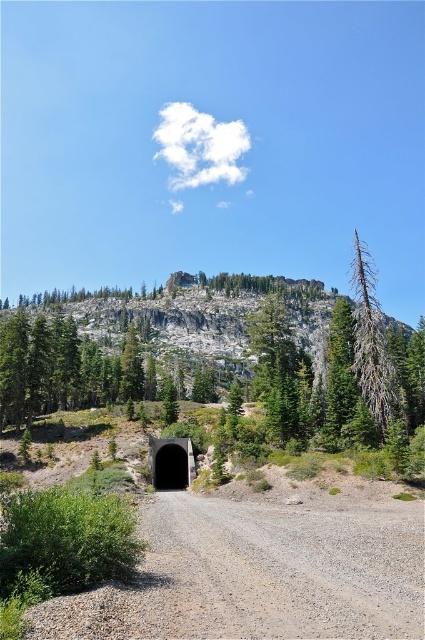
Between gray gravel road at lower center and gray rocky mountain at upper center, which one is positioned higher?

gray rocky mountain at upper center

Which is more to the left, gray gravel road at lower center or gray rocky mountain at upper center?

gray rocky mountain at upper center is more to the left.

This screenshot has width=425, height=640. Describe the element at coordinates (258, 573) in the screenshot. I see `gray gravel road at lower center` at that location.

Identify the location of gray gravel road at lower center. [x=258, y=573].

Is grayish-brown bark tree at right bigger than black concrete tunnel at center?

Indeed, grayish-brown bark tree at right has a larger size compared to black concrete tunnel at center.

Is point (362, 291) positioned after point (195, 472)?

No, it is not.

Identify the location of grayish-brown bark tree at right. (371, 342).

Who is lower down, gray rocky mountain at upper center or black concrete tunnel at center?

black concrete tunnel at center

In the scene shown: Does gray rocky mountain at upper center appear on the left side of black concrete tunnel at center?

Indeed, gray rocky mountain at upper center is positioned on the left side of black concrete tunnel at center.

Describe the element at coordinates (187, 316) in the screenshot. I see `gray rocky mountain at upper center` at that location.

Identify the location of gray rocky mountain at upper center. Image resolution: width=425 pixels, height=640 pixels. (187, 316).